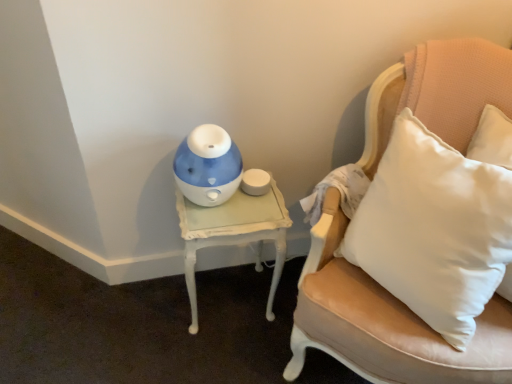
In order to click on free spot above white painted wood table at left (from a real-world perspective) in this screenshot , I will do `click(224, 199)`.